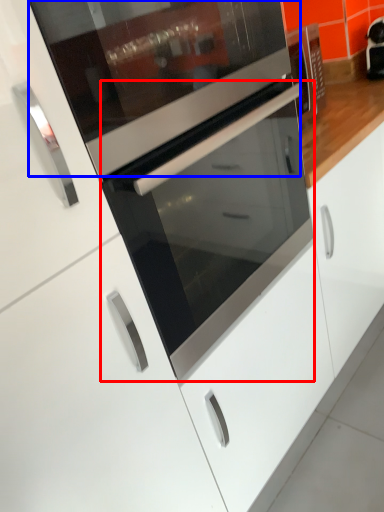
Question: Which object appears farthest to the camera in this image, oven (highlighted by a red box) or appliance (highlighted by a blue box)?

Choices:
 (A) oven
 (B) appliance

Answer: (A)